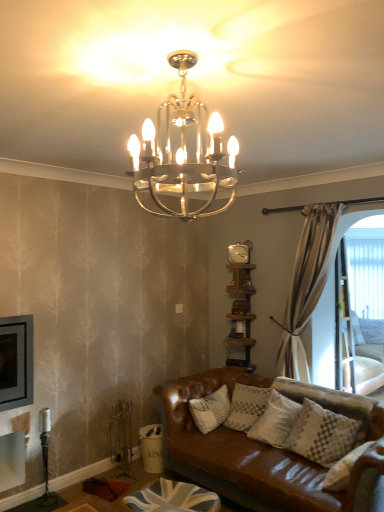
Identify the location of white mesh screen at right. (366, 272).

What do you see at coordinates (173, 498) in the screenshot? Image resolution: width=384 pixels, height=512 pixels. I see `union jack fabric footrest at lower center` at bounding box center [173, 498].

What do you see at coordinates (241, 313) in the screenshot?
I see `brown wooden shelf at right` at bounding box center [241, 313].

The height and width of the screenshot is (512, 384). I want to click on white mesh screen at right, so click(x=366, y=272).

Who is taller, metallic chandelier at upper center or white mesh screen at right?

white mesh screen at right is taller.

Relative to white mesh screen at right, is metallic chandelier at upper center in front or behind?

Clearly, metallic chandelier at upper center is in front of white mesh screen at right.

Considering the relative positions of metallic chandelier at upper center and white mesh screen at right in the image provided, is metallic chandelier at upper center to the right of white mesh screen at right from the viewer's perspective?

No.

Is metallic chandelier at upper center not near white mesh screen at right?

Yes, metallic chandelier at upper center and white mesh screen at right are located far from each other.

Is point (372, 268) positioned in front of point (177, 482)?

No, it is not.

Consider the image. From the image's perspective, which one is positioned lower, white mesh screen at right or union jack fabric footrest at lower center?

union jack fabric footrest at lower center.

Can you confirm if white mesh screen at right is shorter than union jack fabric footrest at lower center?

No.

Considering the positions of objects white mesh screen at right and union jack fabric footrest at lower center in the image provided, who is in front, white mesh screen at right or union jack fabric footrest at lower center?

union jack fabric footrest at lower center is closer to the camera.

In the scene shown: Can we say metallic chandelier at upper center lies outside brown wooden shelf at right?

metallic chandelier at upper center lies outside brown wooden shelf at right's area.

Is point (140, 170) behind point (249, 276)?

No.

Looking at this image, from the image's perspective, which one is positioned higher, metallic chandelier at upper center or brown wooden shelf at right?

metallic chandelier at upper center.

What's the angular difference between metallic chandelier at upper center and brown wooden shelf at right's facing directions?

metallic chandelier at upper center and brown wooden shelf at right are facing 179 degrees away from each other.

Is there a large distance between brown wooden shelf at right and union jack fabric footrest at lower center?

That's right, there is a large distance between brown wooden shelf at right and union jack fabric footrest at lower center.

Based on their positions, is brown wooden shelf at right located to the left or right of union jack fabric footrest at lower center?

In the image, brown wooden shelf at right appears on the right side of union jack fabric footrest at lower center.

From a real-world perspective, is brown wooden shelf at right above or below union jack fabric footrest at lower center?

brown wooden shelf at right is situated higher than union jack fabric footrest at lower center in the real world.

In terms of width, does metallic chandelier at upper center look wider or thinner when compared to union jack fabric footrest at lower center?

metallic chandelier at upper center is thinner than union jack fabric footrest at lower center.

Can you confirm if metallic chandelier at upper center is smaller than union jack fabric footrest at lower center?

Actually, metallic chandelier at upper center might be larger than union jack fabric footrest at lower center.

In the scene shown: Would you consider metallic chandelier at upper center to be distant from union jack fabric footrest at lower center?

Yes, metallic chandelier at upper center is far from union jack fabric footrest at lower center.

How many degrees apart are the facing directions of metallic chandelier at upper center and union jack fabric footrest at lower center?

The angle between the facing direction of metallic chandelier at upper center and the facing direction of union jack fabric footrest at lower center is 171 degrees.

From the image's perspective, is union jack fabric footrest at lower center above metallic chandelier at upper center?

No, from the image's perspective, union jack fabric footrest at lower center is not over metallic chandelier at upper center.

Considering the positions of objects union jack fabric footrest at lower center and metallic chandelier at upper center in the image provided, who is more to the right, union jack fabric footrest at lower center or metallic chandelier at upper center?

From the viewer's perspective, metallic chandelier at upper center appears more on the right side.

From a real-world perspective, between union jack fabric footrest at lower center and metallic chandelier at upper center, who is vertically lower?

In real-world perspective, union jack fabric footrest at lower center is lower.

Would you say union jack fabric footrest at lower center is inside or outside white mesh screen at right?

union jack fabric footrest at lower center is outside white mesh screen at right.

Can you see union jack fabric footrest at lower center touching white mesh screen at right?

union jack fabric footrest at lower center is not next to white mesh screen at right, and they're not touching.

Between union jack fabric footrest at lower center and white mesh screen at right, which one has smaller width?

white mesh screen at right is thinner.

From the image's perspective, is union jack fabric footrest at lower center above or below white mesh screen at right?

From the image's perspective, union jack fabric footrest at lower center appears below white mesh screen at right.

I want to click on lamp in front of the white mesh screen at right, so click(x=183, y=155).

Where is `window screen that appears on the right of union jack fabric footrest at lower center`? This screenshot has height=512, width=384. window screen that appears on the right of union jack fabric footrest at lower center is located at coordinates (366, 272).

Which object lies nearer to the anchor point white mesh screen at right, brown wooden shelf at right or metallic chandelier at upper center?

brown wooden shelf at right is closer to white mesh screen at right.

Which object lies nearer to the anchor point brown wooden shelf at right, metallic chandelier at upper center or union jack fabric footrest at lower center?

union jack fabric footrest at lower center is positioned closer to the anchor brown wooden shelf at right.

Based on their spatial positions, is white mesh screen at right or brown wooden shelf at right further from metallic chandelier at upper center?

Among the two, white mesh screen at right is located further to metallic chandelier at upper center.

Looking at the image, which one is located further to brown wooden shelf at right, metallic chandelier at upper center or white mesh screen at right?

metallic chandelier at upper center is positioned further to the anchor brown wooden shelf at right.

Looking at the image, which one is located further to union jack fabric footrest at lower center, white mesh screen at right or brown wooden shelf at right?

white mesh screen at right.

When comparing their distances from union jack fabric footrest at lower center, does white mesh screen at right or metallic chandelier at upper center seem closer?

metallic chandelier at upper center.

Consider the image. Looking at the image, which one is located further to metallic chandelier at upper center, brown wooden shelf at right or union jack fabric footrest at lower center?

Based on the image, union jack fabric footrest at lower center appears to be further to metallic chandelier at upper center.

Considering their positions, is white mesh screen at right positioned further to brown wooden shelf at right than metallic chandelier at upper center?

metallic chandelier at upper center.

Find the location of a particular element. footrest between metallic chandelier at upper center and brown wooden shelf at right in the front-back direction is located at coordinates (173, 498).

Locate an element on the screen. This screenshot has height=512, width=384. shelf positioned between union jack fabric footrest at lower center and white mesh screen at right from near to far is located at coordinates (241, 313).

At what (x,y) coordinates should I click in order to perform the action: click on shelf between metallic chandelier at upper center and white mesh screen at right from front to back. Please return your answer as a coordinate pair (x, y). Looking at the image, I should click on (241, 313).

Image resolution: width=384 pixels, height=512 pixels. Identify the location of the footrest located between metallic chandelier at upper center and white mesh screen at right in the depth direction. (173, 498).